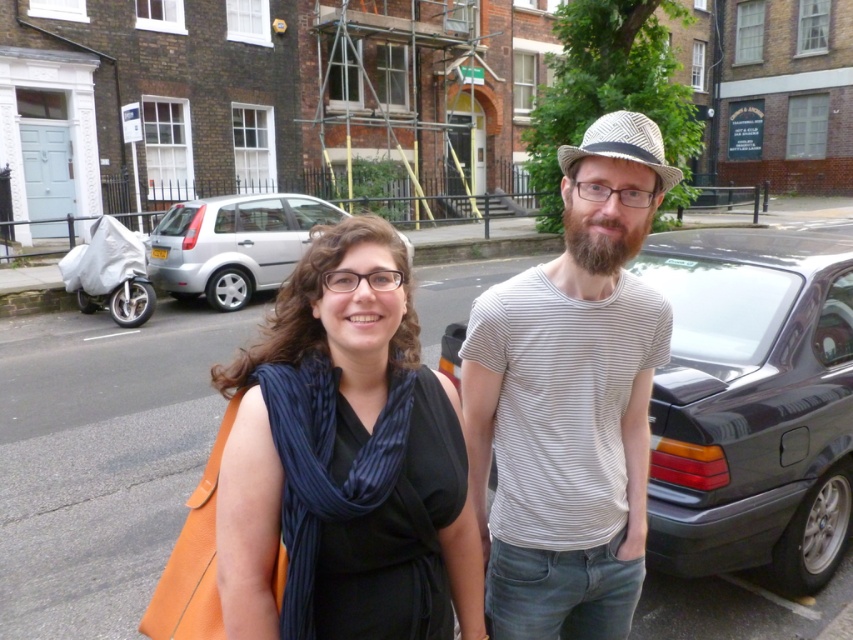
You are a drone operator trying to capture a photo of the black silk scarf at center. The camera is currently positioned at point A, which is at coordinates 0.5, 0.5. To ensure the scarf is in the center of the photo, should you adjust the camera position to the left or right? Please explain your reasoning.

The black silk scarf at center is located at coordinates (370, 436). Since the camera is at (426, 320), the scarf is to the right and slightly below the current camera position. To center it, move the camera to the right and down slightly.